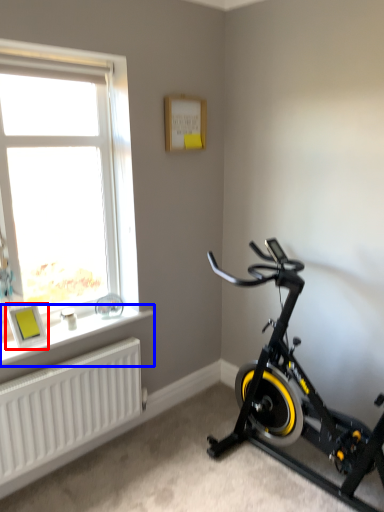
Question: Which point is closer to the camera, picture frame (highlighted by a red box) or window sill (highlighted by a blue box)?

Choices:
 (A) picture frame
 (B) window sill

Answer: (B)